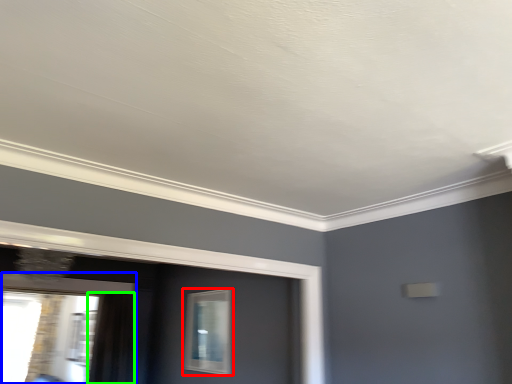
Question: Which object is the farthest from window (highlighted by a red box)? Choose among these: window (highlighted by a blue box) or curtain (highlighted by a green box).

Choices:
 (A) window
 (B) curtain

Answer: (A)